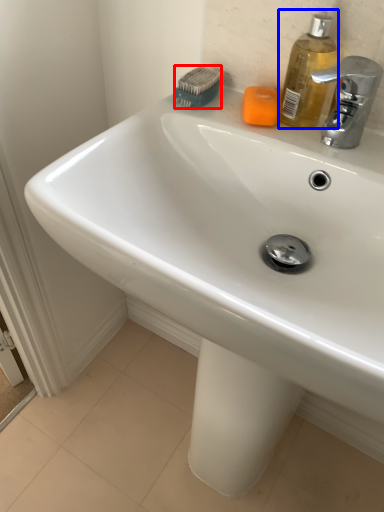
Question: Which object is further to the camera taking this photo, brush (highlighted by a red box) or soap dispenser (highlighted by a blue box)?

Choices:
 (A) brush
 (B) soap dispenser

Answer: (A)